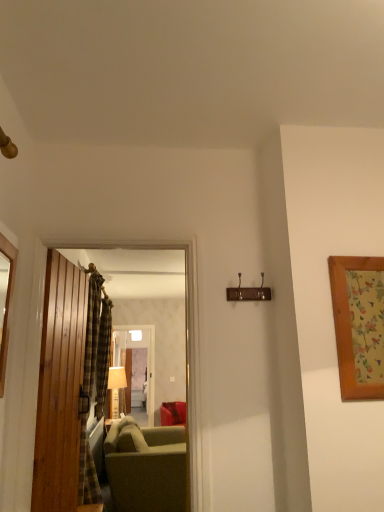
Question: Does matte beige lamp at center have a greater width compared to wooden picture frame at right, which is the second picture frame from left to right?

Choices:
 (A) yes
 (B) no

Answer: (A)

Question: Is matte beige lamp at center not near wooden picture frame at right, arranged as the 1th picture frame when viewed from the right?

Choices:
 (A) no
 (B) yes

Answer: (B)

Question: Is matte beige lamp at center positioned in front of wooden picture frame at right, arranged as the 1th picture frame when viewed from the right?

Choices:
 (A) yes
 (B) no

Answer: (B)

Question: Is matte beige lamp at center aimed at wooden picture frame at right, arranged as the 1th picture frame when viewed from the right?

Choices:
 (A) yes
 (B) no

Answer: (B)

Question: Does matte beige lamp at center lie behind wooden picture frame at right, arranged as the 1th picture frame when viewed from the right?

Choices:
 (A) no
 (B) yes

Answer: (B)

Question: Is matte beige lamp at center outside wooden picture frame at right, arranged as the 1th picture frame when viewed from the right?

Choices:
 (A) no
 (B) yes

Answer: (B)

Question: Is wooden door at center, which is the 2th door from left to right, aimed at wooden door at left, which is counted as the second door, starting from the right?

Choices:
 (A) yes
 (B) no

Answer: (B)

Question: Is the position of wooden door at center, the first door from the right, less distant than that of wooden door at left, which is counted as the second door, starting from the right?

Choices:
 (A) yes
 (B) no

Answer: (A)

Question: Considering the relative sizes of wooden door at center, which is the 2th door from left to right, and wooden door at left, which is counted as the second door, starting from the right, in the image provided, is wooden door at center, which is the 2th door from left to right, taller than wooden door at left, which is counted as the second door, starting from the right,?

Choices:
 (A) no
 (B) yes

Answer: (A)

Question: Considering the relative sizes of wooden door at center, the first door from the right, and wooden door at left, which is counted as the second door, starting from the right, in the image provided, is wooden door at center, the first door from the right, shorter than wooden door at left, which is counted as the second door, starting from the right,?

Choices:
 (A) yes
 (B) no

Answer: (A)

Question: Is wooden door at center, which is the 2th door from left to right, outside wooden door at left, acting as the 1th door starting from the left?

Choices:
 (A) yes
 (B) no

Answer: (A)

Question: From the image's perspective, would you say wooden door at center, which is the 2th door from left to right, is shown under wooden door at left, which is counted as the second door, starting from the right?

Choices:
 (A) no
 (B) yes

Answer: (A)

Question: Considering the relative sizes of plaid fabric curtain at left, arranged as the 2th curtain when viewed from the right, and wooden mirror at left, marked as the first picture frame in a left-to-right arrangement, in the image provided, is plaid fabric curtain at left, arranged as the 2th curtain when viewed from the right, taller than wooden mirror at left, marked as the first picture frame in a left-to-right arrangement,?

Choices:
 (A) yes
 (B) no

Answer: (A)